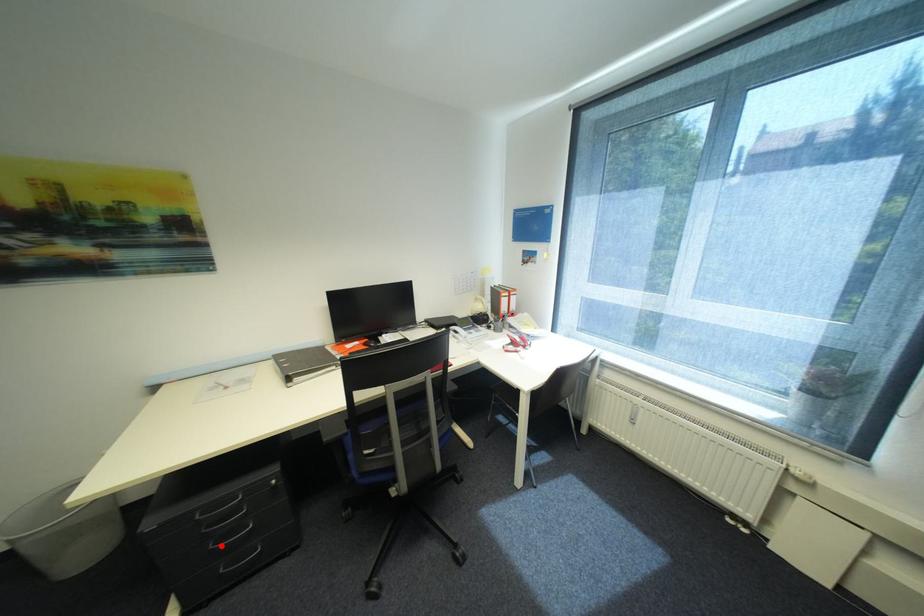
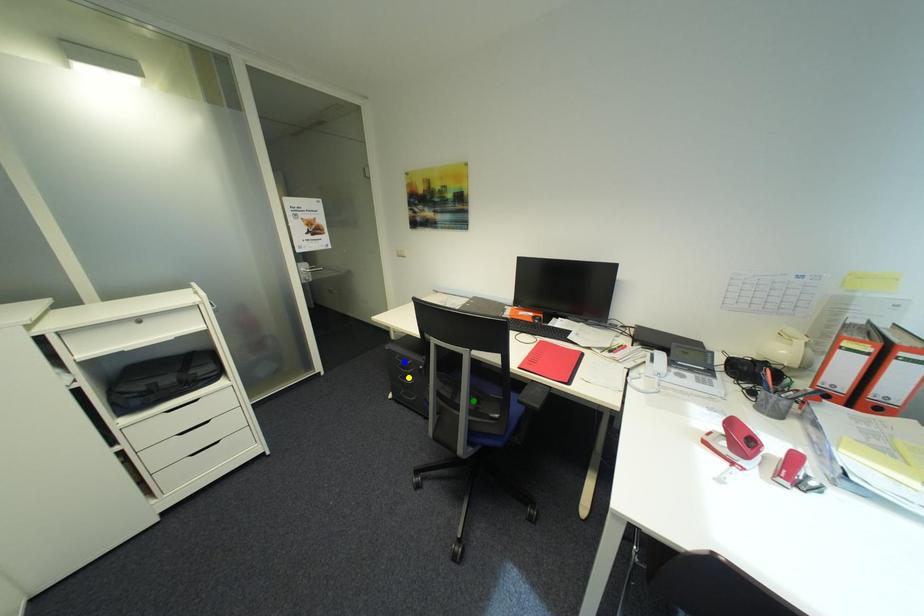
Question: I am providing you with two images of the same scene from different viewpoints. A red point is marked on the first image. You are given multiple points on the second image. Which mark in image 2 goes with the point in image 1?

Choices:
 (A) yellow point
 (B) blue point
 (C) green point

Answer: (A)